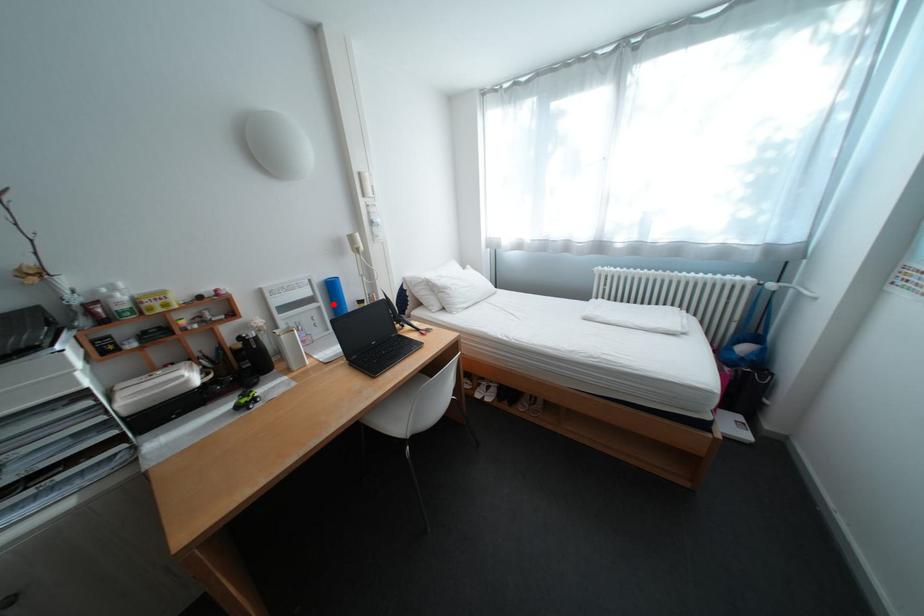
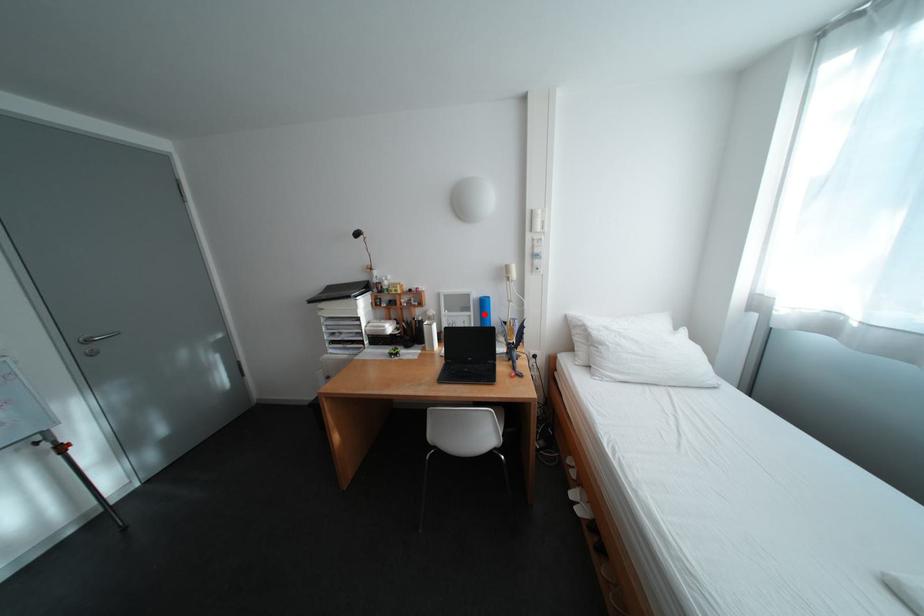
I am providing you with two images of the same scene from different viewpoints. A red point is marked on the first image and another point is marked on the second image. Does the point marked in image1 correspond to the same location as the one in image2?

Yes